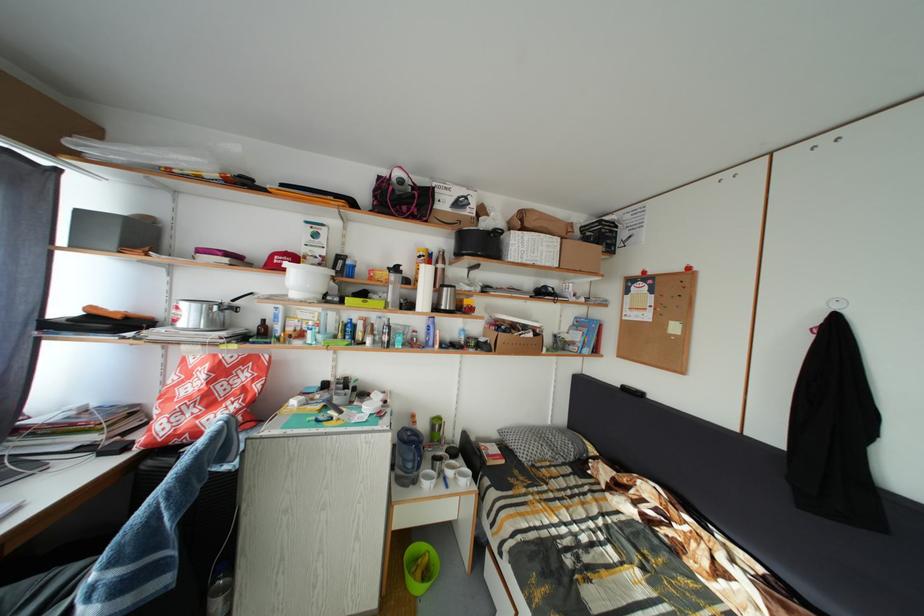
This screenshot has width=924, height=616. I want to click on red baseball cap, so click(x=280, y=259).